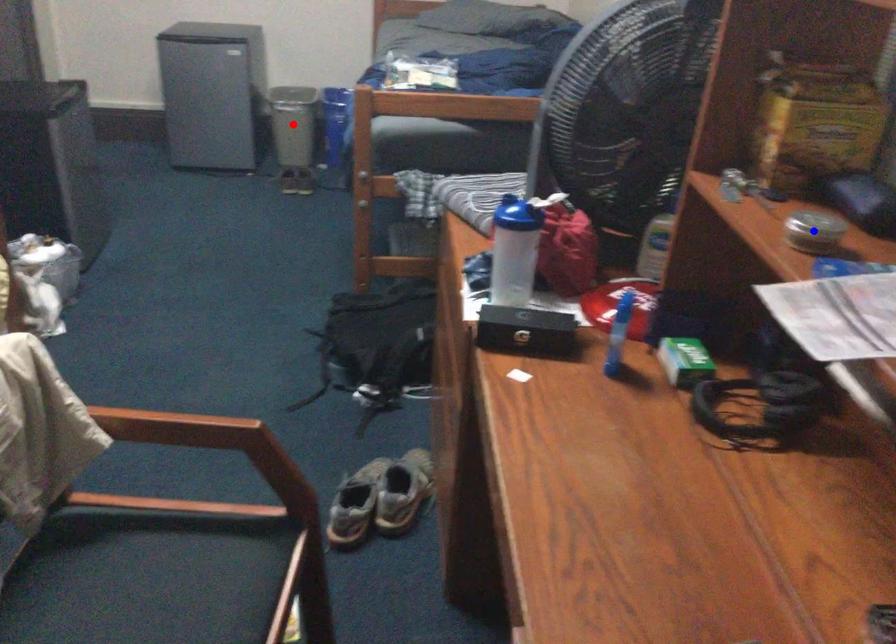
Question: In the image, two points are highlighted. Which point is nearer to the camera? Reply with the corresponding letter.

Choices:
 (A) blue point
 (B) red point

Answer: (A)